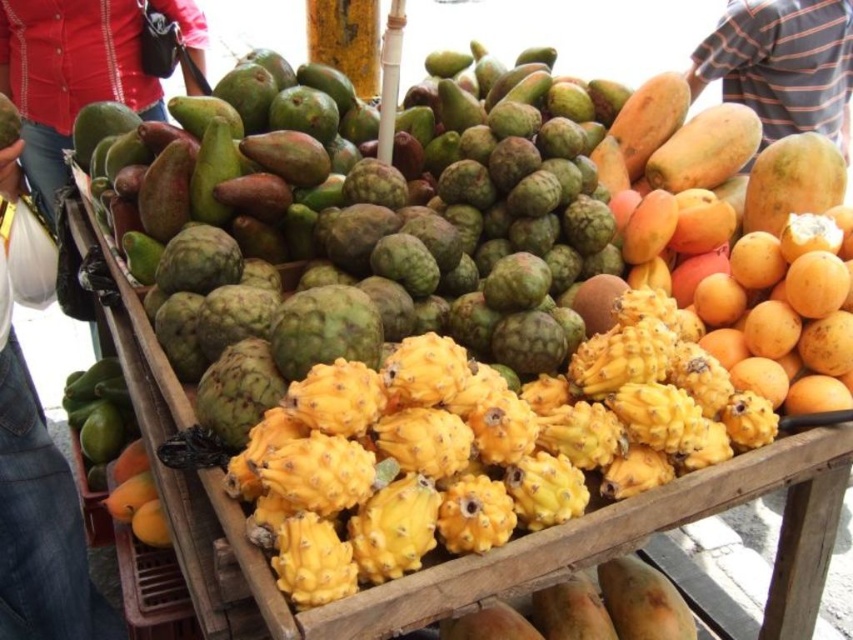
You are standing at the market stall looking at the fruit display. There are two points marked on the display. One is at coordinate point (22, 115) and the other is at point (759, 92). Which point is closer to you?

The point at coordinate point (22, 115) is closer to you than the point at (759, 92).

You are looking at the market stall scene. There is a point labeled at coordinates [68,76]. What object is located at that point?

The point at coordinates [68,76] indicates the location of the matte red shirt at upper left.

You are a customer at a clothing store and see the matte red shirt at upper left and the striped cotton shirt at upper right. The store has a narrow aisle between the racks. If the aisle is 2 meters wide, can you walk between the two shirts without touching them?

The matte red shirt at upper left and the striped cotton shirt at upper right are 2.62 meters apart from each other. Since the aisle is 2 meters wide, you can walk between them but will need to stay centered to avoid touching either shirt.